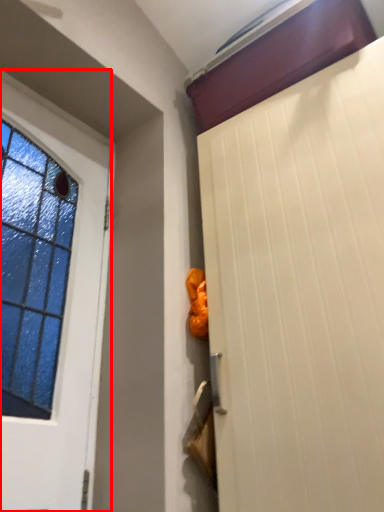
Question: From the image's perspective, considering the relative positions of door (annotated by the red box) and door in the image provided, where is door (annotated by the red box) located with respect to the staircase?

Choices:
 (A) below
 (B) above

Answer: (B)